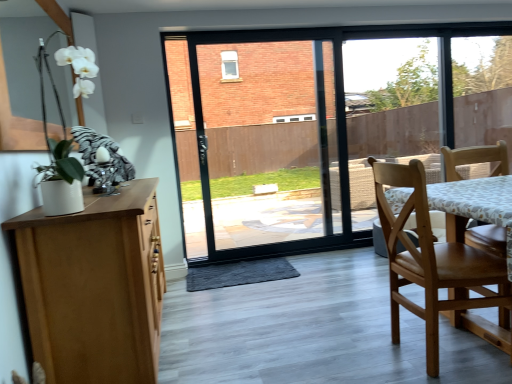
Question: Would you say wooden chair at right is part of white matte orchid at upper left's contents?

Choices:
 (A) yes
 (B) no

Answer: (B)

Question: From the image's perspective, is white matte orchid at upper left located beneath wooden chair at right?

Choices:
 (A) no
 (B) yes

Answer: (A)

Question: Is white matte orchid at upper left facing away from wooden chair at right?

Choices:
 (A) no
 (B) yes

Answer: (A)

Question: Does white matte orchid at upper left appear on the left side of wooden chair at right?

Choices:
 (A) no
 (B) yes

Answer: (B)

Question: Considering the relative sizes of white matte orchid at upper left and wooden chair at right in the image provided, is white matte orchid at upper left smaller than wooden chair at right?

Choices:
 (A) yes
 (B) no

Answer: (A)

Question: Is white matte orchid at upper left shorter than wooden chair at right?

Choices:
 (A) yes
 (B) no

Answer: (A)

Question: Is wooden chair at right bigger than white matte orchid at upper left?

Choices:
 (A) yes
 (B) no

Answer: (A)

Question: Is wooden chair at right located outside white matte orchid at upper left?

Choices:
 (A) no
 (B) yes

Answer: (B)

Question: From a real-world perspective, is wooden chair at right below white matte orchid at upper left?

Choices:
 (A) no
 (B) yes

Answer: (B)

Question: Considering the relative sizes of wooden chair at right and white matte orchid at upper left in the image provided, is wooden chair at right thinner than white matte orchid at upper left?

Choices:
 (A) no
 (B) yes

Answer: (A)

Question: Does wooden chair at right appear on the left side of white matte orchid at upper left?

Choices:
 (A) yes
 (B) no

Answer: (B)

Question: Considering the relative sizes of wooden chair at right and white matte orchid at upper left in the image provided, is wooden chair at right wider than white matte orchid at upper left?

Choices:
 (A) yes
 (B) no

Answer: (A)

Question: Is white matte orchid at upper left bigger or smaller than wooden chair at right?

Choices:
 (A) small
 (B) big

Answer: (A)